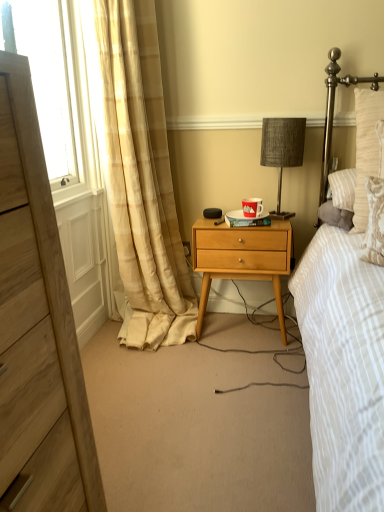
Question: Is textured gray lampshade at center to the left or to the right of woven fabric headboard at upper right in the image?

Choices:
 (A) right
 (B) left

Answer: (B)

Question: Looking at their shapes, would you say textured gray lampshade at center is wider or thinner than woven fabric headboard at upper right?

Choices:
 (A) wide
 (B) thin

Answer: (B)

Question: Considering the real-world distances, which object is closest to the wooden nightstand at center?

Choices:
 (A) textured gray lampshade at center
 (B) transparent glass window screen at left
 (C) beige plaid curtain at left
 (D) wooden chest of drawers at left
 (E) woven fabric headboard at upper right

Answer: (C)

Question: Which object is positioned closest to the wooden nightstand at center?

Choices:
 (A) woven fabric headboard at upper right
 (B) transparent glass window screen at left
 (C) textured gray lampshade at center
 (D) wooden chest of drawers at left
 (E) beige plaid curtain at left

Answer: (E)